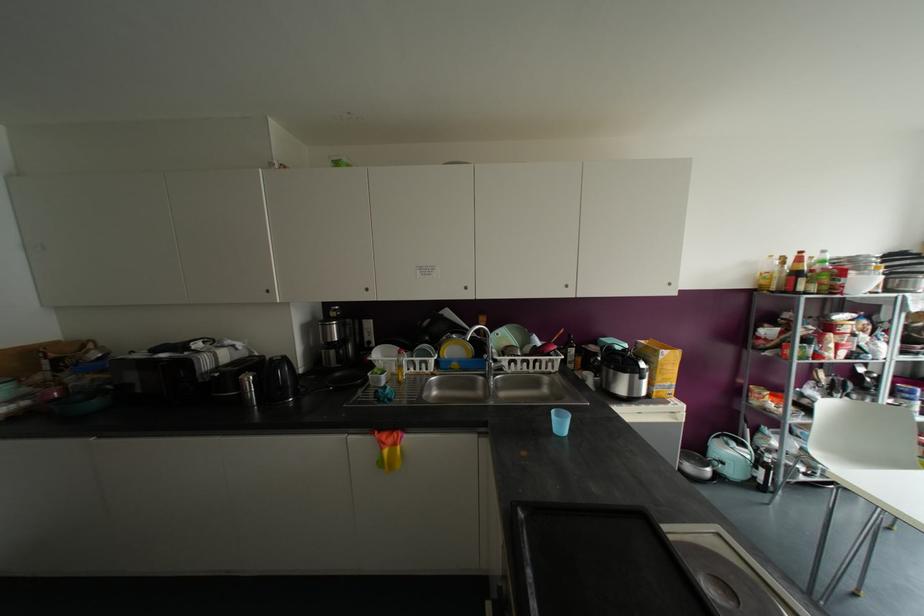
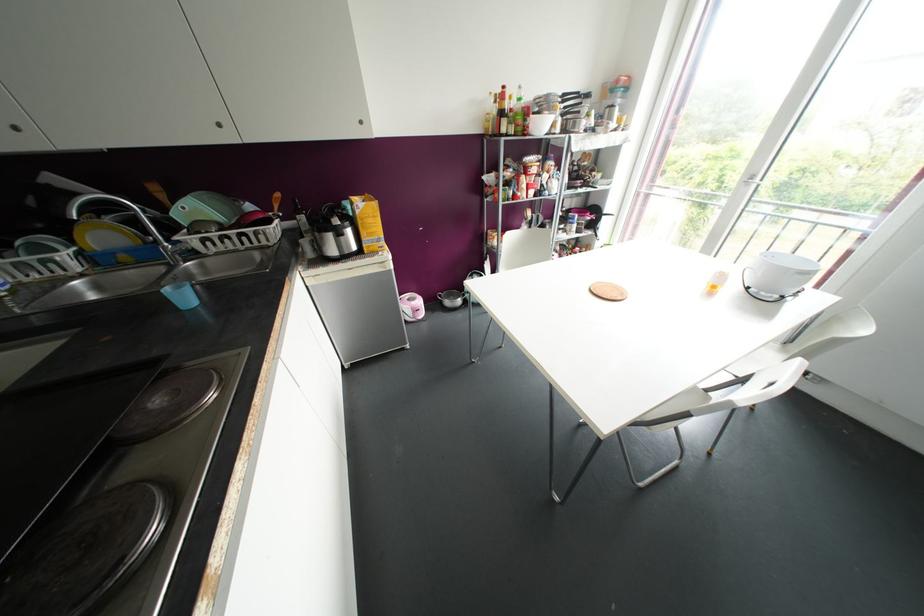
In the second image, find the point that corresponds to the point at 669,284 in the first image.

(360, 122)